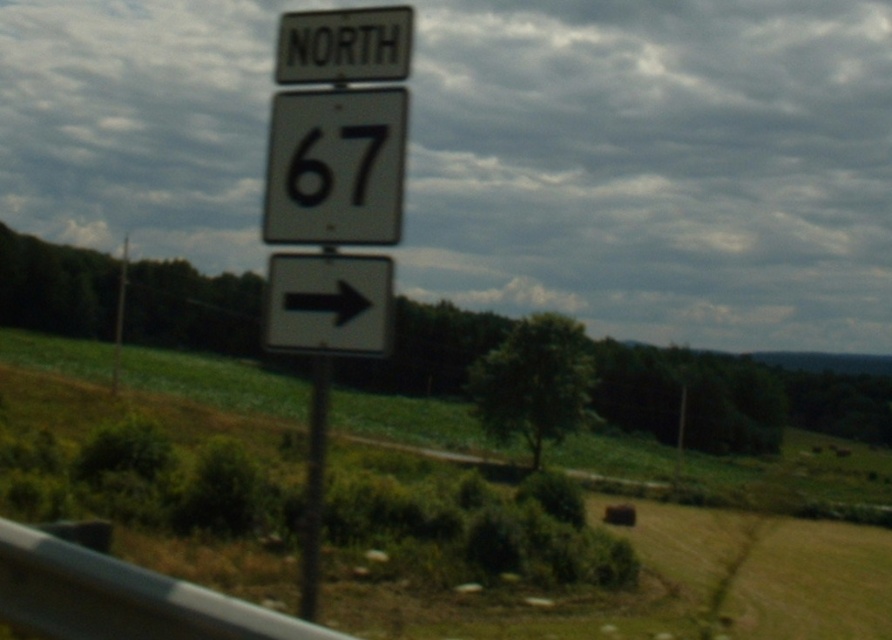
You are a driver approaching the white glossy sign at center and the black matte number at center. Which object will appear bigger to you as you drive closer?

The white glossy sign at center will appear bigger than the black matte number at center as you approach because it is larger in size.